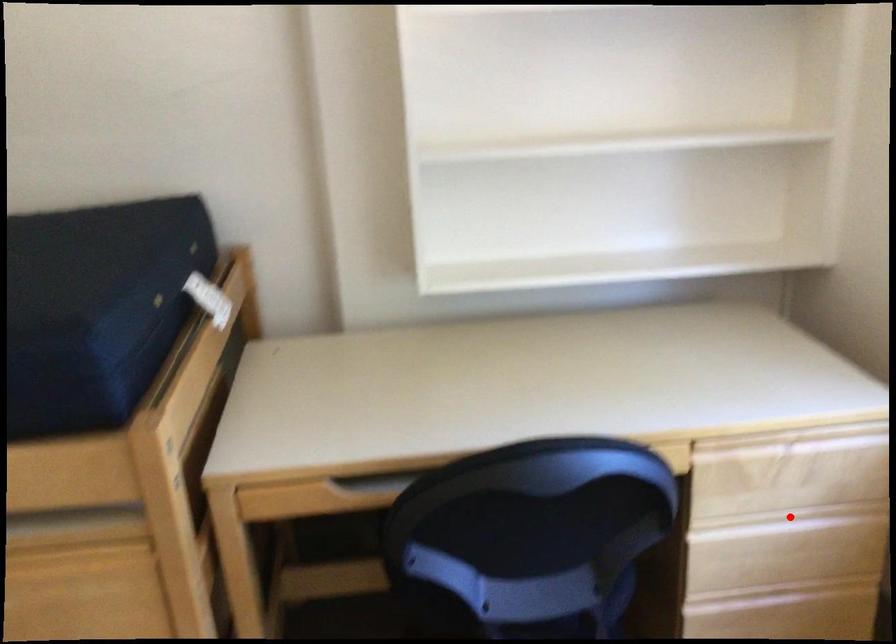
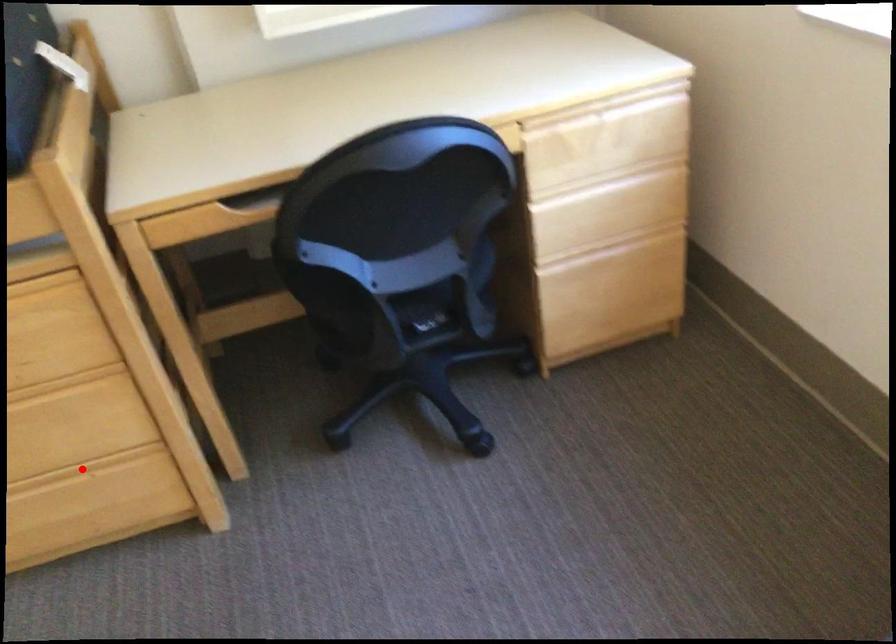
I am providing you with two images of the same scene from different viewpoints. A red point is marked on the first image and another point is marked on the second image. Are the points marked in image1 and image2 representing the same 3D position?

No